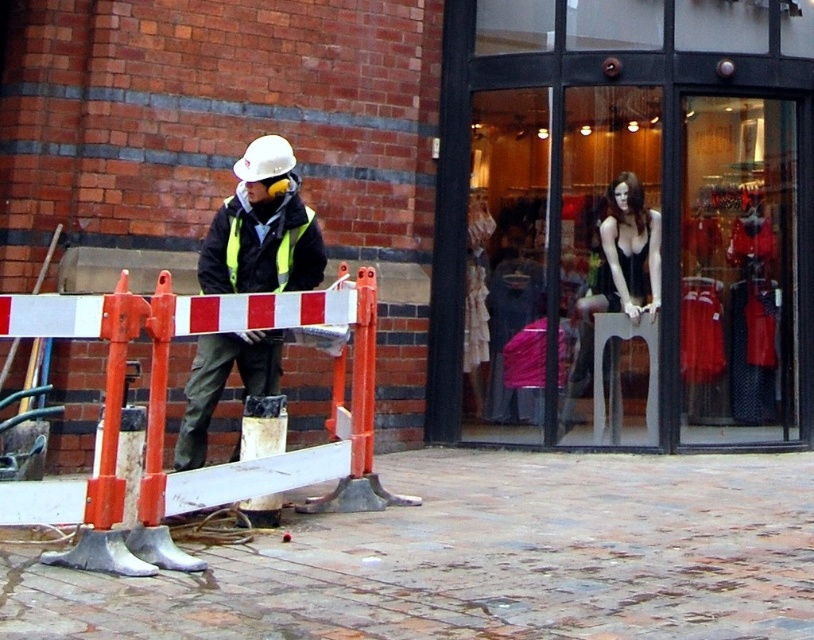
You are standing at the point where the construction worker is located. You want to reach a point that is 8 meters away from you. Is the point at coordinates point (712, 208) within this 8 meter range?

The distance of point (712, 208) from viewer is 8.10 meters, so the point is just slightly beyond the 8 meter range. You would need to move forward approximately 0.10 meters to reach it.